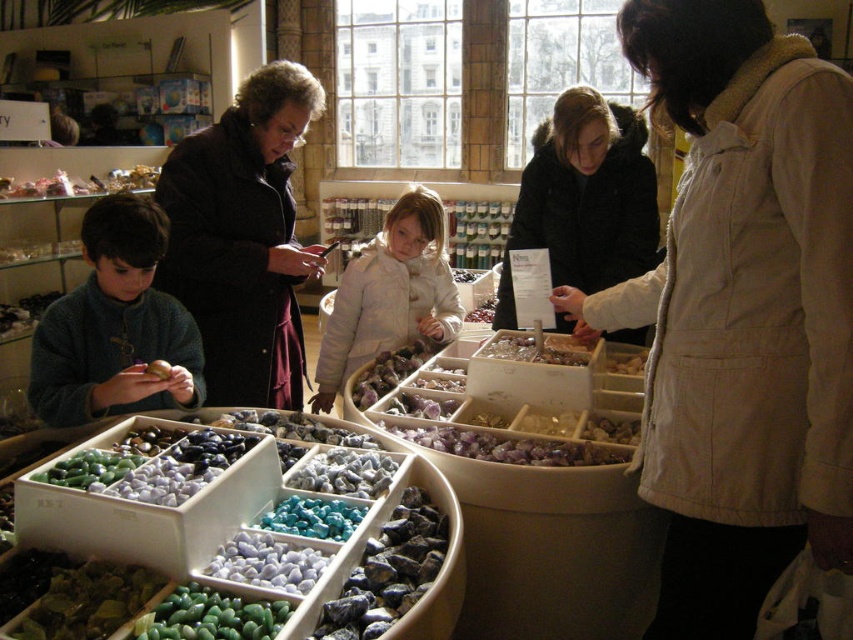
Question: Is black fur-trimmed coat at center further to camera compared to white fuzzy coat at center?

Choices:
 (A) yes
 (B) no

Answer: (B)

Question: Which of these objects is positioned closest to the smooth polished stones at center?

Choices:
 (A) black fur-trimmed coat at center
 (B) dark blue sweater at left
 (C) dark brown coat at center
 (D) beige cotton vest at center

Answer: (B)

Question: Among these objects, which one is farthest from the camera?

Choices:
 (A) white fuzzy coat at center
 (B) dark brown coat at center

Answer: (A)

Question: Observing the image, what is the correct spatial positioning of beige cotton vest at center in reference to dark blue sweater at left?

Choices:
 (A) below
 (B) above

Answer: (A)

Question: Is beige cotton vest at center smaller than black fur-trimmed coat at center?

Choices:
 (A) no
 (B) yes

Answer: (A)

Question: Among these objects, which one is farthest from the camera?

Choices:
 (A) dark blue sweater at left
 (B) smooth polished stones at center
 (C) dark brown coat at center

Answer: (C)